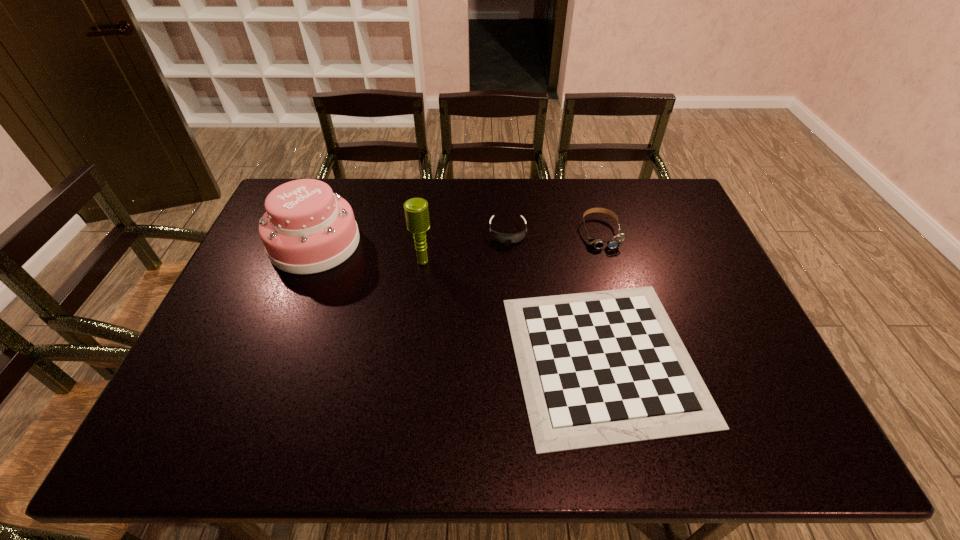
The height and width of the screenshot is (540, 960). What are the coordinates of `free space between the cake and the shorter goggles` in the screenshot? It's located at (411, 238).

Locate an element on the screen. The height and width of the screenshot is (540, 960). vacant area between the leftmost object and the microphone is located at coordinates (369, 252).

At what (x,y) coordinates should I click in order to perform the action: click on object that stands as the third closest to the cake. Please return your answer as a coordinate pair (x, y). Looking at the image, I should click on (600, 368).

The image size is (960, 540). I want to click on object that is the second nearest to the right goggles, so click(500, 237).

What are the coordinates of `vacant region that satisfies the following two spatial constraints: 1. on the front and sides of the nearest object; 2. on the right side of the second shortest object` in the screenshot? It's located at (516, 358).